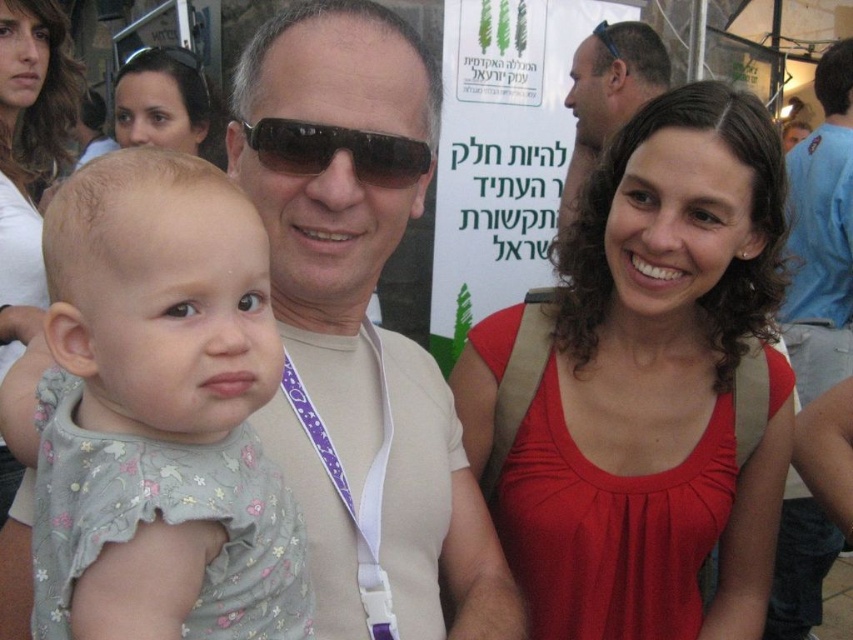
Does light gray floral dress at center-left appear on the left side of black plastic goggles at upper left?

In fact, light gray floral dress at center-left is to the right of black plastic goggles at upper left.

Between point (51, 424) and point (134, 51), which one is positioned in front?

Point (51, 424)

Which is in front, point (96, 406) or point (190, 52)?

Point (96, 406) is in front.

You are a GUI agent. You are given a task and a screenshot of the screen. Output one action in this format:
    pyautogui.click(x=<x>, y=<y>)
    Task: Click on the light gray floral dress at center-left
    This screenshot has height=640, width=853.
    Given the screenshot: What is the action you would take?
    pyautogui.click(x=160, y=413)

Is matte black sunglasses at upper left smaller than sunglasses at center?

Incorrect, matte black sunglasses at upper left is not smaller in size than sunglasses at center.

Does matte black sunglasses at upper left appear over sunglasses at center?

Yes, matte black sunglasses at upper left is above sunglasses at center.

Between point (137, 115) and point (421, 154), which one is positioned behind?

Point (137, 115)

This screenshot has width=853, height=640. I want to click on matte black sunglasses at upper left, so click(161, 100).

The height and width of the screenshot is (640, 853). In order to click on blue cotton shirt at upper right in this screenshot , I will do `click(821, 234)`.

Who is positioned more to the right, blue cotton shirt at upper right or matte black sunglasses at upper left?

blue cotton shirt at upper right is more to the right.

Identify the location of blue cotton shirt at upper right. This screenshot has height=640, width=853. (821, 234).

Locate an element on the screen. This screenshot has width=853, height=640. blue cotton shirt at upper right is located at coordinates (821, 234).